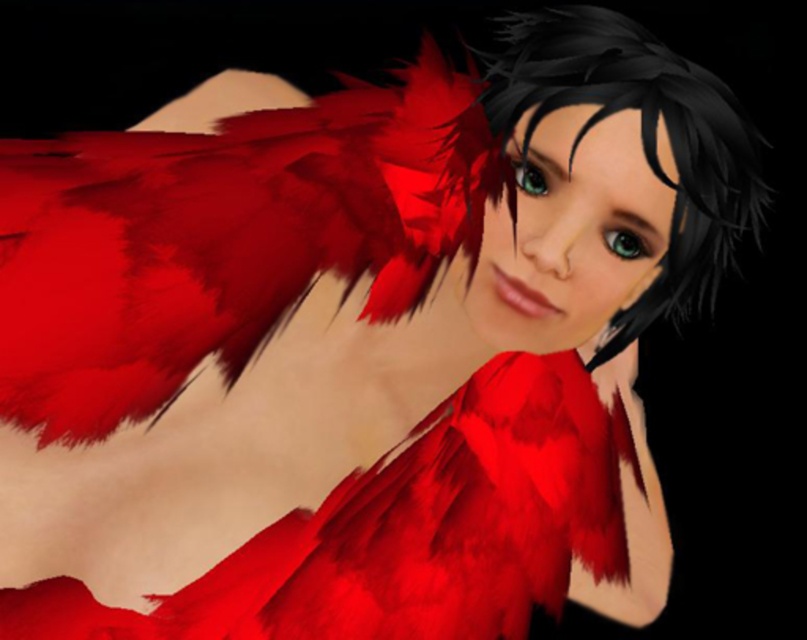
Is velvet-like red dress at center smaller than black matte hair at upper center?

No.

In the scene shown: Who is higher up, velvet-like red dress at center or black matte hair at upper center?

black matte hair at upper center is above.

Does point (286, 604) come behind point (755, 125)?

No.

I want to click on velvet-like red dress at center, so click(408, 531).